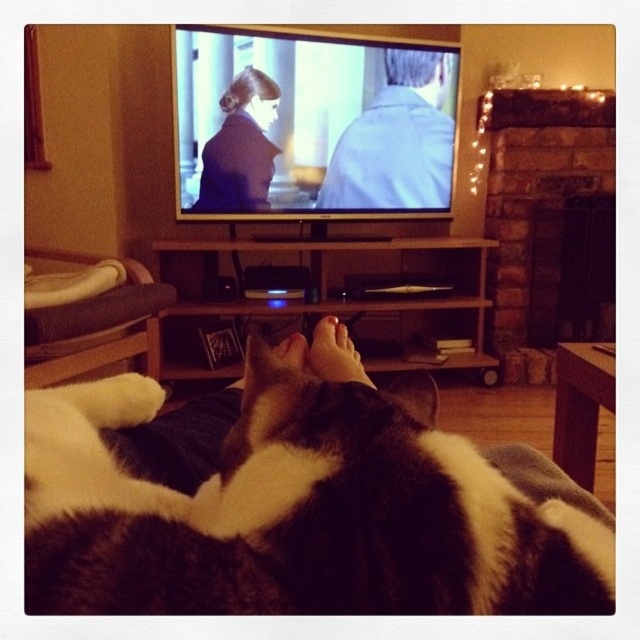
Question: Does matte black coat at upper left appear on the right side of brown soft skin at center?

Choices:
 (A) no
 (B) yes

Answer: (A)

Question: Based on their relative distances, which object is nearer to the brown soft skin at center?

Choices:
 (A) black and white fur at lower center
 (B) matte black coat at upper left
 (C) matte skin foot at center
 (D) light blue shirt at upper center

Answer: (C)

Question: Can you confirm if wooden entertainment center at center is smaller than light blue shirt at upper center?

Choices:
 (A) no
 (B) yes

Answer: (A)

Question: Can you confirm if wooden entertainment center at center is positioned above light blue shirt at upper center?

Choices:
 (A) yes
 (B) no

Answer: (B)

Question: Which point is closer to the camera taking this photo?

Choices:
 (A) (440, 246)
 (B) (396, 131)
 (C) (300, 358)
 (D) (440, 568)

Answer: (D)

Question: Among these objects, which one is nearest to the camera?

Choices:
 (A) wooden entertainment center at center
 (B) black and white fur at lower center
 (C) matte skin foot at center

Answer: (B)